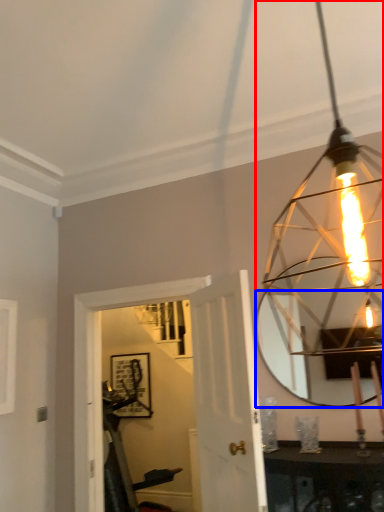
Question: Which object is closer to the camera taking this photo, lamp (highlighted by a red box) or mirror (highlighted by a blue box)?

Choices:
 (A) lamp
 (B) mirror

Answer: (A)